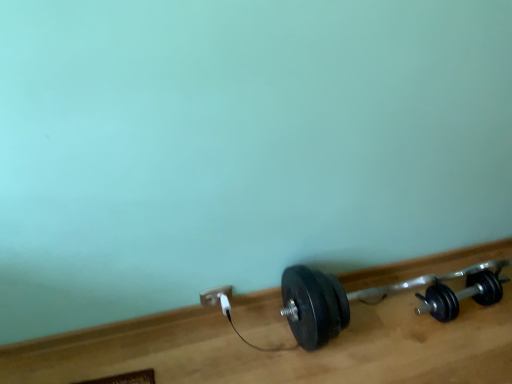
At what (x,y) coordinates should I click in order to perform the action: click on vacant area situated to the left side of white plastic plug at lower center. Please return your answer as a coordinate pair (x, y). The width and height of the screenshot is (512, 384). Looking at the image, I should click on (177, 336).